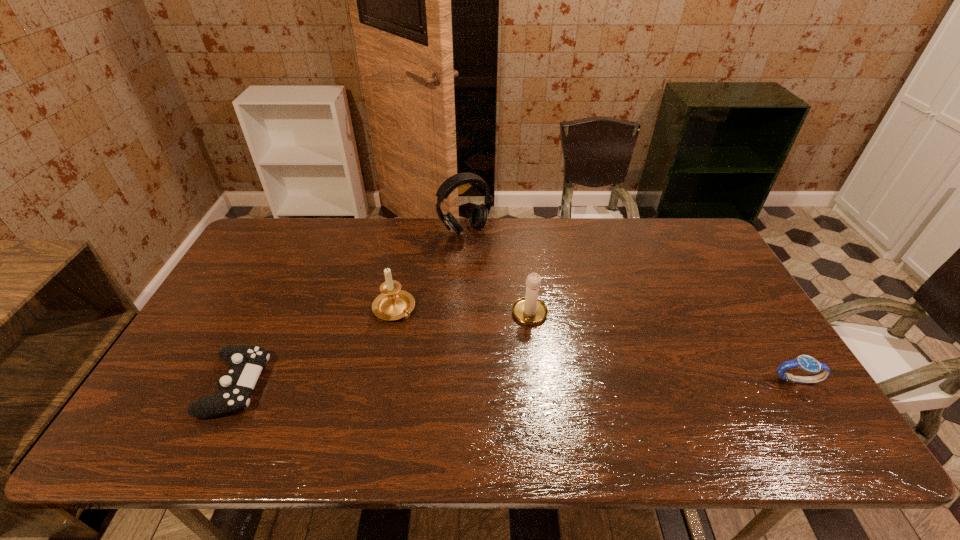
Where is `control`? control is located at coordinates (246, 362).

Where is `watch`? Image resolution: width=960 pixels, height=540 pixels. watch is located at coordinates (806, 363).

This screenshot has height=540, width=960. I want to click on earphone, so click(479, 214).

Where is `the third object from right to left`? The height and width of the screenshot is (540, 960). the third object from right to left is located at coordinates (479, 214).

Locate an element on the screen. the fourth object from right to left is located at coordinates (392, 304).

In order to click on the right candle holder in this screenshot , I will do `click(530, 310)`.

Find the location of a particular element. vacant point located on the surface of the control is located at coordinates (351, 385).

In order to click on vacant space located on the back of the watch in this screenshot , I will do `click(753, 311)`.

This screenshot has height=540, width=960. I want to click on blank area located 0.270m on the ear cups of the third object from left to right, so click(x=513, y=290).

Locate an element on the screen. Image resolution: width=960 pixels, height=540 pixels. free space located 0.090m on the ear cups of the third object from left to right is located at coordinates (488, 256).